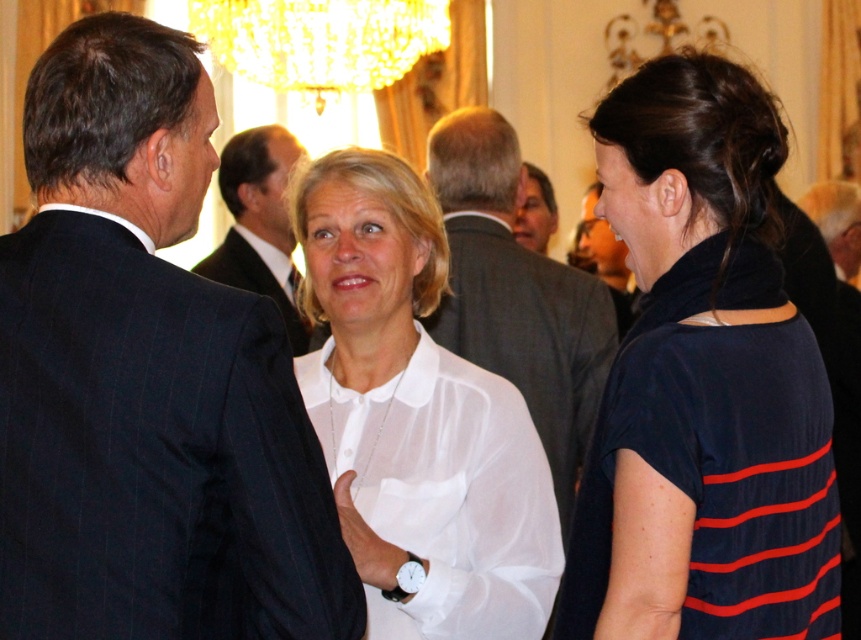
Question: Which object appears closest to the camera in this image?

Choices:
 (A) dark blue striped shirt at right
 (B) smooth gray suit at center
 (C) white sheer blouse at center

Answer: (A)

Question: Which point is farther to the camera?

Choices:
 (A) gray suit jacket at center
 (B) white sheer blouse at center
 (C) dark blue suit at center
 (D) dark blue striped shirt at right

Answer: (C)

Question: Does dark blue pinstripe suit at center appear over smooth gray suit at center?

Choices:
 (A) no
 (B) yes

Answer: (A)

Question: Is white sheer blouse at center to the right of gray suit jacket at center from the viewer's perspective?

Choices:
 (A) yes
 (B) no

Answer: (B)

Question: Is dark blue suit at center to the right of smooth gray suit at center from the viewer's perspective?

Choices:
 (A) yes
 (B) no

Answer: (B)

Question: Which point is closer to the camera?

Choices:
 (A) white sheer blouse at center
 (B) dark blue striped shirt at right
 (C) gray suit jacket at center

Answer: (B)